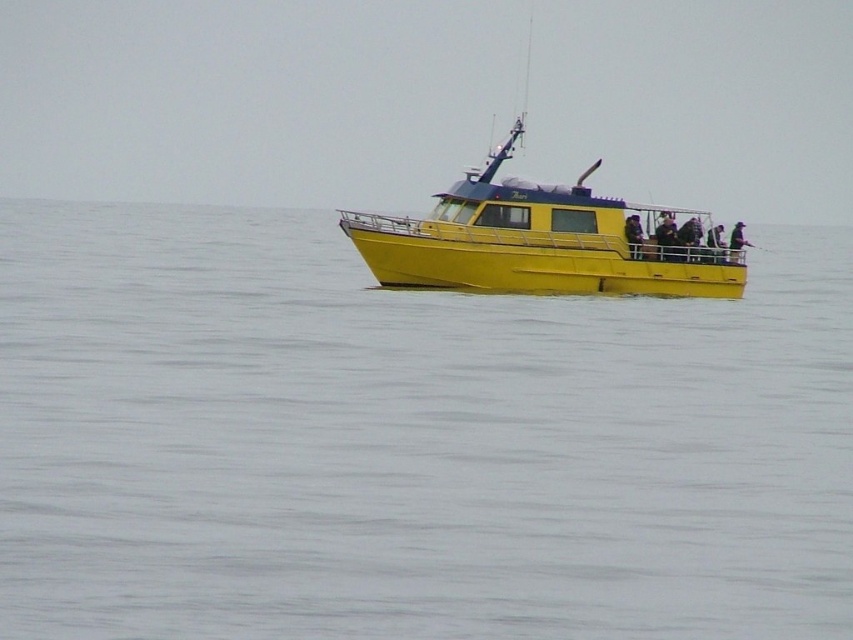
Which is in front, point (569, 262) or point (633, 237)?

Point (569, 262) is more forward.

In the scene shown: Can you confirm if yellow matte boat at center is taller than dark blue fabric jacket at center?

Yes.

Is point (602, 202) in front of point (633, 241)?

Yes, point (602, 202) is in front of point (633, 241).

You are a GUI agent. You are given a task and a screenshot of the screen. Output one action in this format:
    pyautogui.click(x=<x>, y=<y>)
    Task: Click on the yellow matte boat at center
    
    Given the screenshot: What is the action you would take?
    pyautogui.click(x=543, y=241)

Is yellow matte water at center bigger than yellow matte boat at center?

Correct, yellow matte water at center is larger in size than yellow matte boat at center.

Is yellow matte water at center positioned before yellow matte boat at center?

Yes, it is.

Describe the element at coordinates (408, 442) in the screenshot. I see `yellow matte water at center` at that location.

You are a GUI agent. You are given a task and a screenshot of the screen. Output one action in this format:
    pyautogui.click(x=<x>, y=<y>)
    Task: Click on the yellow matte water at center
    
    Given the screenshot: What is the action you would take?
    pyautogui.click(x=408, y=442)

Which is more to the left, yellow matte water at center or dark blue fabric jacket at center?

From the viewer's perspective, yellow matte water at center appears more on the left side.

Is point (554, 481) closer to viewer compared to point (639, 252)?

Yes, it is in front of point (639, 252).

Find the location of a particular element. The image size is (853, 640). yellow matte water at center is located at coordinates (408, 442).